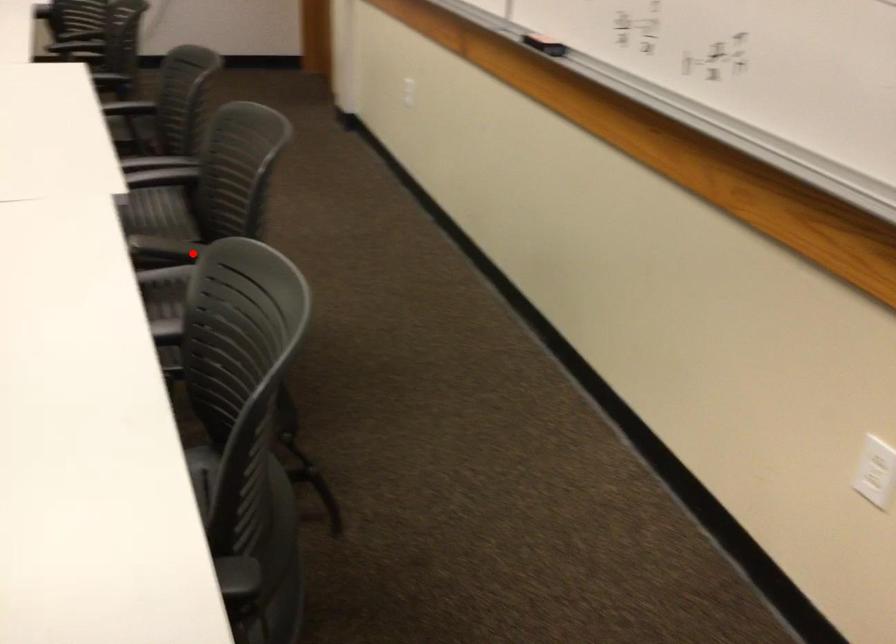
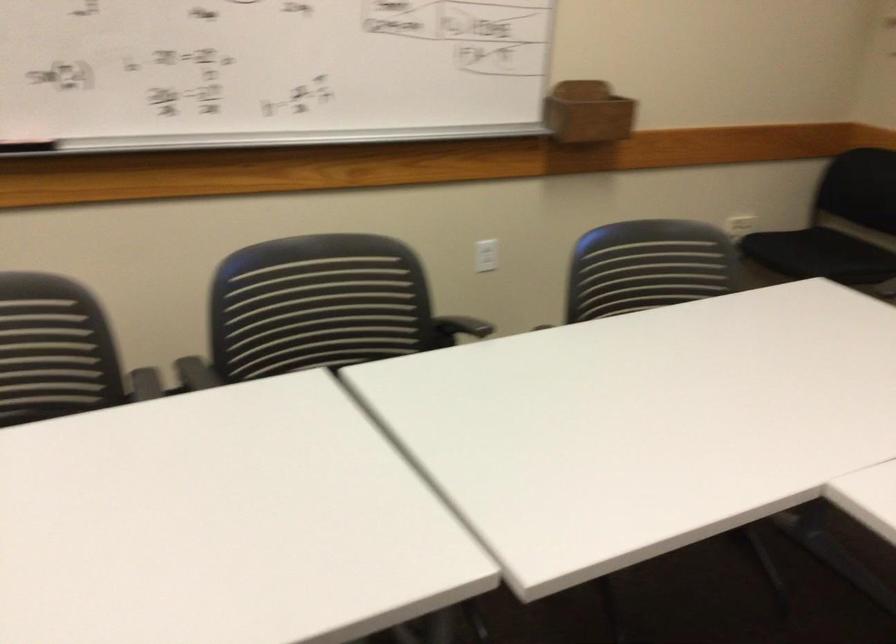
Find the pixel in the second image that matches the highlighted location in the first image.

(458, 328)